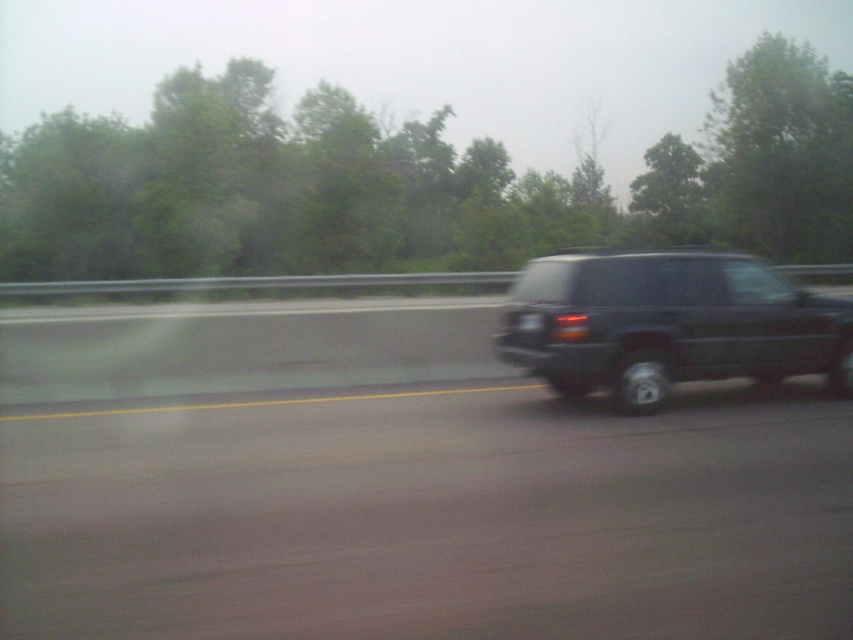
Which is below, black matte suv at right or green leafy tree at upper right?

black matte suv at right

Can you confirm if black matte suv at right is thinner than green leafy tree at upper right?

Correct, black matte suv at right's width is less than green leafy tree at upper right's.

Is point (657, 284) in front of point (843, 237)?

That is True.

In order to click on black matte suv at right in this screenshot , I will do `click(668, 324)`.

Which is above, green leafy tree at upper center or black matte suv at right?

Positioned higher is green leafy tree at upper center.

Does green leafy tree at upper center have a greater width compared to black matte suv at right?

Yes.

Is point (776, 172) positioned in front of point (683, 250)?

No, it is not.

I want to click on green leafy tree at upper center, so click(410, 182).

Is green leafy tree at upper center above green leafy tree at upper right?

No, green leafy tree at upper center is not above green leafy tree at upper right.

Which is in front, point (395, 138) or point (817, 244)?

Point (817, 244) is more forward.

Between point (61, 129) and point (758, 232), which one is positioned in front?

Point (61, 129) is in front.

What are the coordinates of `green leafy tree at upper center` in the screenshot? It's located at (410, 182).